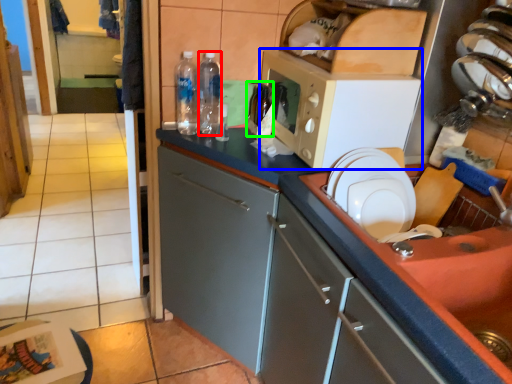
Question: Considering the real-world distances, which object is farthest from bottle (highlighted by a red box)? microwave oven (highlighted by a blue box) or bottle (highlighted by a green box)?

Choices:
 (A) microwave oven
 (B) bottle

Answer: (A)